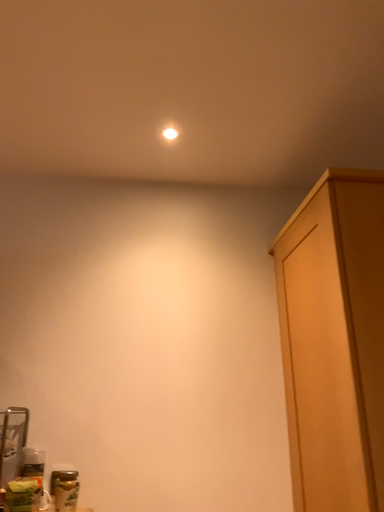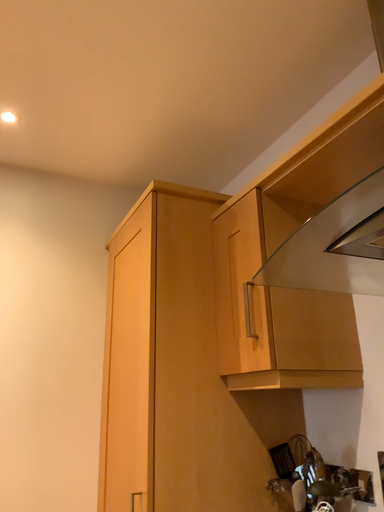
Question: Which way did the camera rotate in the video?

Choices:
 (A) rotated left
 (B) rotated right

Answer: (B)